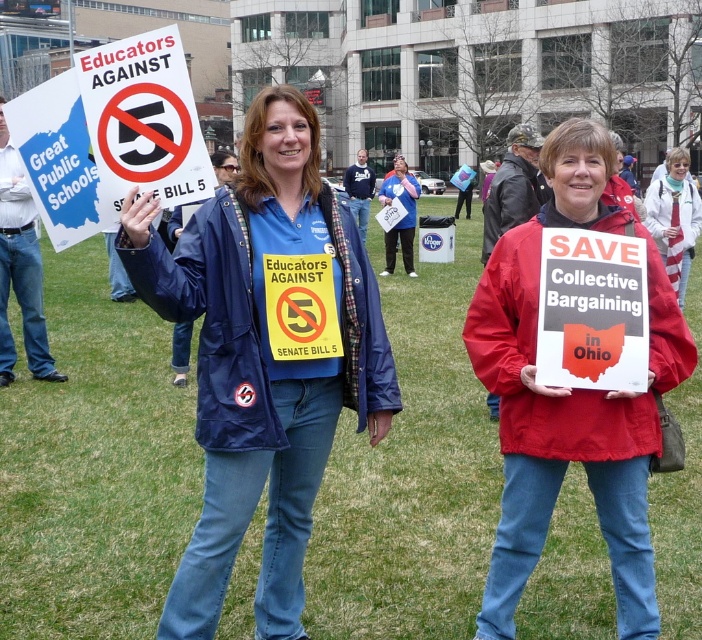
Question: In this image, where is blue fabric jacket at center located relative to red paper sign at center?

Choices:
 (A) above
 (B) below

Answer: (B)

Question: Estimate the real-world distances between objects in this image. Which object is closer to the green grass at center?

Choices:
 (A) red paper sign at center
 (B) blue fabric shirt at center

Answer: (A)

Question: Which point appears farthest from the camera in this image?

Choices:
 (A) (675, 490)
 (B) (311, 124)

Answer: (A)

Question: Is white paper sign at upper left to the right of blue fabric shirt at center from the viewer's perspective?

Choices:
 (A) no
 (B) yes

Answer: (A)

Question: Among these points, which one is nearest to the camera?

Choices:
 (A) (121, 406)
 (B) (647, 321)
 (C) (185, 132)
 (D) (665, 339)

Answer: (C)

Question: In this image, where is blue fabric jacket at center located relative to white paper sign at upper left?

Choices:
 (A) right
 (B) left

Answer: (A)